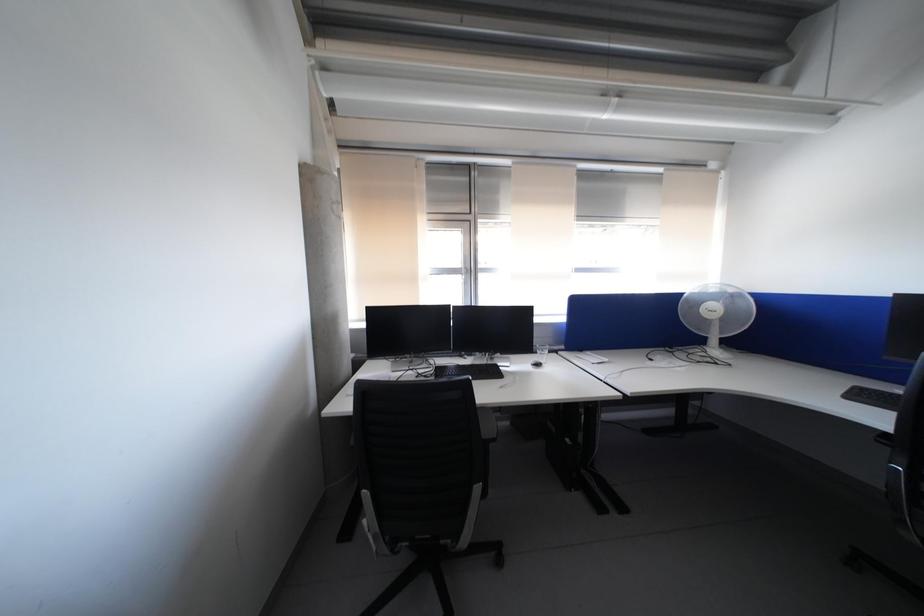
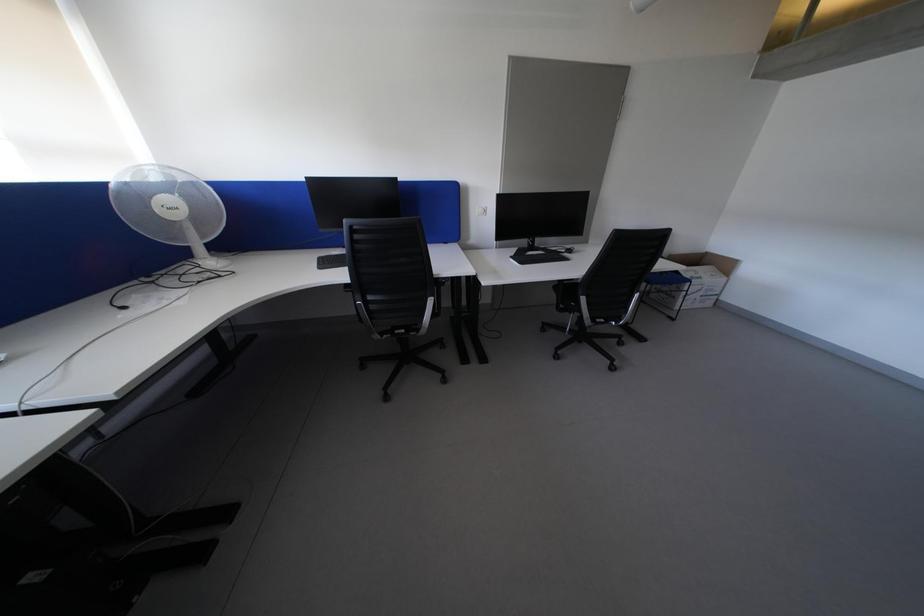
The first image is from the beginning of the video and the second image is from the end. How did the camera likely rotate when shooting the video?

The camera rotated toward right-down.